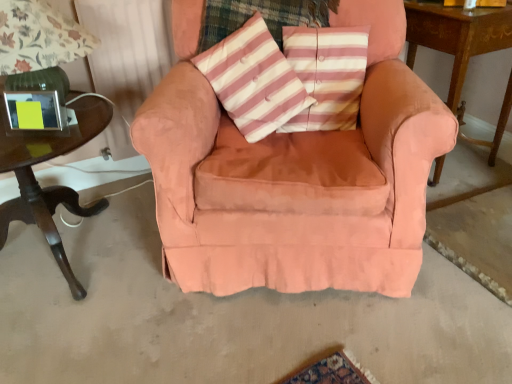
At what (x,y) coordinates should I click in order to perform the action: click on free space between dark wood table at left, positioned as the second table in right-to-left order, and suede-like peach armchair at center. Please return your answer as a coordinate pair (x, y). This screenshot has width=512, height=384. Looking at the image, I should click on 147,276.